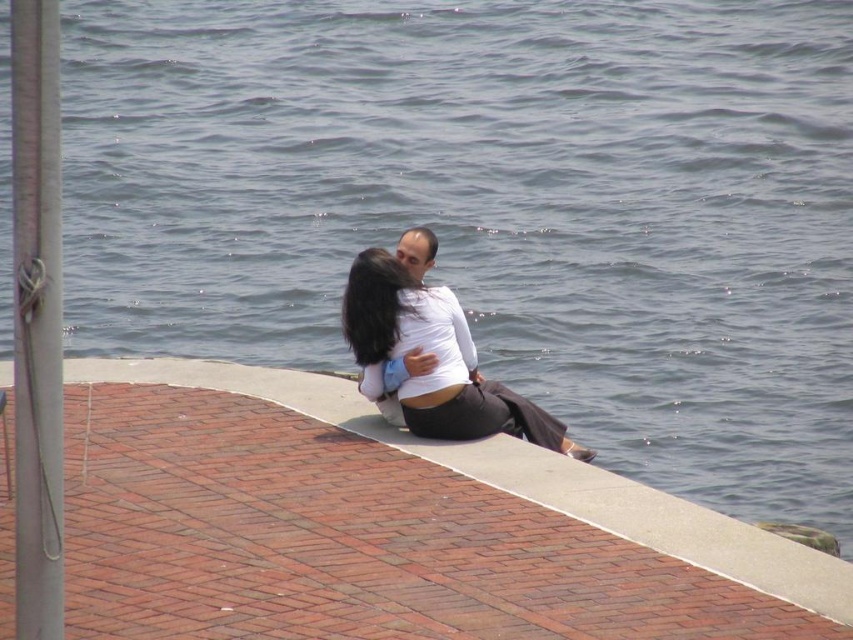
Between point (489, 516) and point (28, 113), which one is positioned behind?

Point (489, 516)

Where is `concrete ledge at center`? Image resolution: width=853 pixels, height=640 pixels. concrete ledge at center is located at coordinates (434, 513).

Locate an element on the screen. Image resolution: width=853 pixels, height=640 pixels. metallic gray pole at left is located at coordinates (36, 320).

Which is more to the right, metallic gray pole at left or matte white blouse at center?

From the viewer's perspective, matte white blouse at center appears more on the right side.

Which is in front, point (44, 497) or point (413, 264)?

Positioned in front is point (44, 497).

At what (x,y) coordinates should I click in order to perform the action: click on metallic gray pole at left. Please return your answer as a coordinate pair (x, y). The height and width of the screenshot is (640, 853). Looking at the image, I should click on (36, 320).

Who is lower down, concrete ledge at center or matte white blouse at center?

Positioned lower is concrete ledge at center.

In the scene shown: Does concrete ledge at center have a lesser width compared to matte white blouse at center?

No, concrete ledge at center is not thinner than matte white blouse at center.

Is point (599, 472) farther from viewer compared to point (419, 401)?

That is False.

Locate an element on the screen. The image size is (853, 640). concrete ledge at center is located at coordinates (434, 513).